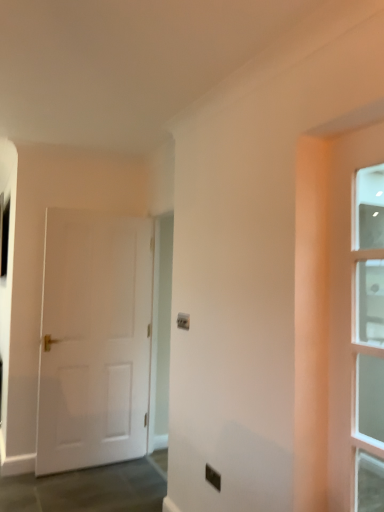
This screenshot has height=512, width=384. In order to click on white matte door at left, the first door when ordered from left to right in this screenshot , I will do `click(94, 340)`.

What do you see at coordinates (213, 477) in the screenshot?
I see `black plastic electric outlet at center` at bounding box center [213, 477].

Where is `white matte door at left, positioned as the 1th door in back-to-front order`? The width and height of the screenshot is (384, 512). white matte door at left, positioned as the 1th door in back-to-front order is located at coordinates (94, 340).

From a real-world perspective, is white matte door at left, the first door when ordered from left to right, physically above clear glass door at right, the 1th door in the right-to-left sequence?

Actually, white matte door at left, the first door when ordered from left to right, is physically below clear glass door at right, the 1th door in the right-to-left sequence, in the real world.

Find the location of a particular element. The width and height of the screenshot is (384, 512). door above the white matte door at left, the second door in the right-to-left sequence (from the image's perspective) is located at coordinates (343, 298).

In the image, is white matte door at left, positioned as the 1th door in back-to-front order, on the left side or the right side of clear glass door at right, arranged as the first door when viewed from the front?

white matte door at left, positioned as the 1th door in back-to-front order, is positioned on clear glass door at right, arranged as the first door when viewed from the front,'s left side.

From a real-world perspective, which is physically above, white matte door at left, positioned as the 1th door in back-to-front order, or black plastic electric outlet at center?

In real-world perspective, white matte door at left, positioned as the 1th door in back-to-front order, is above.

Who is shorter, white matte door at left, acting as the second door starting from the front, or black plastic electric outlet at center?

black plastic electric outlet at center.

Is the depth of white matte door at left, positioned as the 1th door in back-to-front order, greater than that of black plastic electric outlet at center?

Yes, it is behind black plastic electric outlet at center.

Is white matte door at left, the second door in the right-to-left sequence, located outside black plastic electric outlet at center?

white matte door at left, the second door in the right-to-left sequence, lies outside black plastic electric outlet at center's area.

From the image's perspective, which one is positioned lower, clear glass door at right, the 2th door viewed from the left, or white matte door at left, the second door in the right-to-left sequence?

white matte door at left, the second door in the right-to-left sequence, appears lower in the image.

Could you tell me if clear glass door at right, the 2th door from the back, is facing white matte door at left, the second door in the right-to-left sequence?

No, clear glass door at right, the 2th door from the back, does not turn towards white matte door at left, the second door in the right-to-left sequence.

Is point (337, 285) in front of point (107, 403)?

Yes, it is in front of point (107, 403).

From a real-world perspective, is clear glass door at right, the 2th door viewed from the left, below white matte door at left, the first door when ordered from left to right?

No, from a real-world perspective, clear glass door at right, the 2th door viewed from the left, is not under white matte door at left, the first door when ordered from left to right.

Consider the image. From a real-world perspective, is clear glass door at right, the 1th door in the right-to-left sequence, under black plastic electric outlet at center?

No, from a real-world perspective, clear glass door at right, the 1th door in the right-to-left sequence, is not under black plastic electric outlet at center.

From the image's perspective, is clear glass door at right, the 2th door viewed from the left, over black plastic electric outlet at center?

Yes, from the image's perspective, clear glass door at right, the 2th door viewed from the left, is over black plastic electric outlet at center.

Which of these two, clear glass door at right, the 1th door in the right-to-left sequence, or black plastic electric outlet at center, stands shorter?

black plastic electric outlet at center.

Is point (341, 172) positioned after point (207, 475)?

No, (341, 172) is in front of (207, 475).

From the image's perspective, is black plastic electric outlet at center under white matte door at left, acting as the second door starting from the front?

Correct, black plastic electric outlet at center appears lower than white matte door at left, acting as the second door starting from the front, in the image.

From a real-world perspective, starting from the black plastic electric outlet at center, which door is the 1st one vertically above it? Please provide its 2D coordinates.

[(94, 340)]

Between black plastic electric outlet at center and white matte door at left, the second door in the right-to-left sequence, which one has smaller size?

black plastic electric outlet at center.

Is black plastic electric outlet at center oriented towards white matte door at left, the first door when ordered from left to right?

No, black plastic electric outlet at center is not oriented towards white matte door at left, the first door when ordered from left to right.

Locate an element on the screen. The width and height of the screenshot is (384, 512). electric outlet that is on the left side of clear glass door at right, the 2th door from the back is located at coordinates (213, 477).

Could you tell me if black plastic electric outlet at center is facing clear glass door at right, arranged as the first door when viewed from the front?

No, black plastic electric outlet at center is not turned towards clear glass door at right, arranged as the first door when viewed from the front.

Is black plastic electric outlet at center closer to camera compared to clear glass door at right, the 2th door from the back?

No.

Locate an element on the screen. The width and height of the screenshot is (384, 512). door above the white matte door at left, the first door when ordered from left to right (from a real-world perspective) is located at coordinates (343, 298).

The width and height of the screenshot is (384, 512). I want to click on door lying on the left of black plastic electric outlet at center, so click(94, 340).

Which object lies nearer to the anchor point black plastic electric outlet at center, clear glass door at right, the 2th door viewed from the left, or white matte door at left, positioned as the 1th door in back-to-front order?

Based on the image, clear glass door at right, the 2th door viewed from the left, appears to be nearer to black plastic electric outlet at center.

From the picture: Looking at the image, which one is located further to white matte door at left, acting as the second door starting from the front, clear glass door at right, the 2th door viewed from the left, or black plastic electric outlet at center?

clear glass door at right, the 2th door viewed from the left, lies further to white matte door at left, acting as the second door starting from the front, than the other object.

Considering their positions, is white matte door at left, the first door when ordered from left to right, positioned closer to clear glass door at right, the 1th door in the right-to-left sequence, than black plastic electric outlet at center?

Among the two, black plastic electric outlet at center is located nearer to clear glass door at right, the 1th door in the right-to-left sequence.

Looking at the image, which one is located closer to white matte door at left, acting as the second door starting from the front, black plastic electric outlet at center or clear glass door at right, the 1th door in the right-to-left sequence?

black plastic electric outlet at center is closer to white matte door at left, acting as the second door starting from the front.

Estimate the real-world distances between objects in this image. Which object is closer to clear glass door at right, the 2th door viewed from the left, black plastic electric outlet at center or white matte door at left, acting as the second door starting from the front?

black plastic electric outlet at center is positioned closer to the anchor clear glass door at right, the 2th door viewed from the left.

Estimate the real-world distances between objects in this image. Which object is further from black plastic electric outlet at center, white matte door at left, positioned as the 1th door in back-to-front order, or clear glass door at right, the 2th door from the back?

Based on the image, white matte door at left, positioned as the 1th door in back-to-front order, appears to be further to black plastic electric outlet at center.

The image size is (384, 512). Find the location of `electric outlet positioned between clear glass door at right, the 2th door from the back, and white matte door at left, acting as the second door starting from the front, from near to far`. electric outlet positioned between clear glass door at right, the 2th door from the back, and white matte door at left, acting as the second door starting from the front, from near to far is located at coordinates coord(213,477).